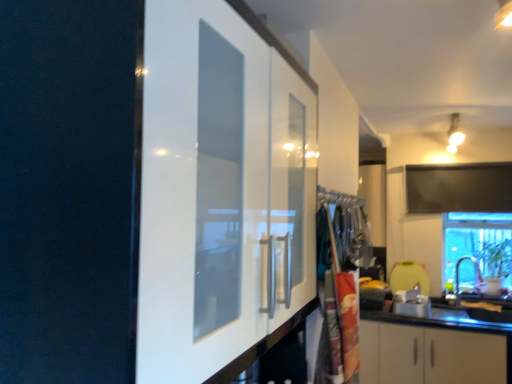
Question: Should I look upward or downward to see matte silver sink at lower right?

Choices:
 (A) up
 (B) down

Answer: (B)

Question: Is transparent glass window at lower right facing towards polyester laundry bag at center?

Choices:
 (A) no
 (B) yes

Answer: (B)

Question: Is transparent glass window at lower right thinner than polyester laundry bag at center?

Choices:
 (A) no
 (B) yes

Answer: (A)

Question: Is transparent glass window at lower right bigger than polyester laundry bag at center?

Choices:
 (A) no
 (B) yes

Answer: (B)

Question: Is transparent glass window at lower right further to camera compared to polyester laundry bag at center?

Choices:
 (A) no
 (B) yes

Answer: (B)

Question: Is transparent glass window at lower right far from polyester laundry bag at center?

Choices:
 (A) no
 (B) yes

Answer: (B)

Question: Can you confirm if transparent glass window at lower right is positioned to the right of polyester laundry bag at center?

Choices:
 (A) no
 (B) yes

Answer: (B)

Question: Is polyester laundry bag at center oriented away from transparent glass window at lower right?

Choices:
 (A) yes
 (B) no

Answer: (B)

Question: Does polyester laundry bag at center have a greater height compared to transparent glass window at lower right?

Choices:
 (A) yes
 (B) no

Answer: (B)

Question: From the image's perspective, would you say polyester laundry bag at center is positioned over transparent glass window at lower right?

Choices:
 (A) yes
 (B) no

Answer: (A)

Question: Does polyester laundry bag at center have a lesser height compared to transparent glass window at lower right?

Choices:
 (A) no
 (B) yes

Answer: (B)

Question: Can you confirm if polyester laundry bag at center is bigger than transparent glass window at lower right?

Choices:
 (A) yes
 (B) no

Answer: (B)

Question: Would you say transparent glass window at lower right is part of polyester laundry bag at center's contents?

Choices:
 (A) yes
 (B) no

Answer: (B)

Question: From the image's perspective, is matte silver sink at lower right below polyester laundry bag at center?

Choices:
 (A) yes
 (B) no

Answer: (A)